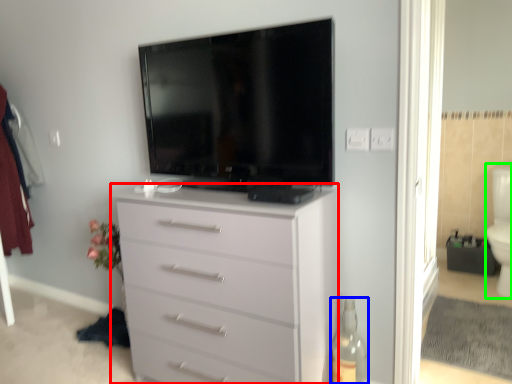
Question: Which is farther away from chest of drawers (highlighted by a red box)? bottle (highlighted by a blue box) or toilet bowl (highlighted by a green box)?

Choices:
 (A) bottle
 (B) toilet bowl

Answer: (B)